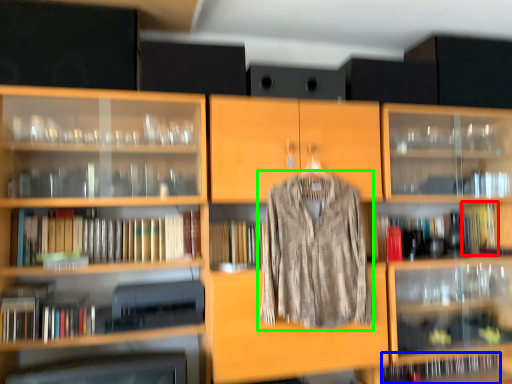
Question: Based on their relative distances, which object is nearer to book (highlighted by a red box)? Choose from book (highlighted by a blue box) and clothing (highlighted by a green box).

Choices:
 (A) book
 (B) clothing

Answer: (A)